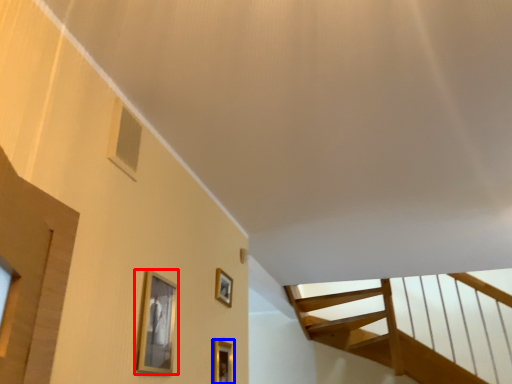
Question: Which point is closer to the camera, picture frame (highlighted by a red box) or picture frame (highlighted by a blue box)?

Choices:
 (A) picture frame
 (B) picture frame

Answer: (A)